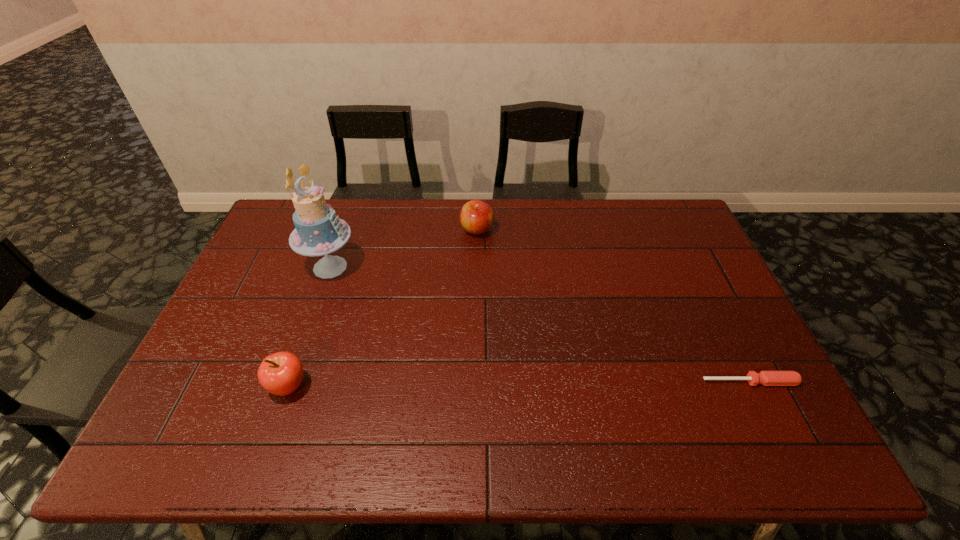
Where is `vacant space located with a ladder on the side of the cake`? The image size is (960, 540). vacant space located with a ladder on the side of the cake is located at coordinates point(438,347).

The height and width of the screenshot is (540, 960). I want to click on free space located 0.210m on the stem of the farther apple, so pos(479,285).

Where is `vacant point located 0.150m on the stem of the farther apple`? vacant point located 0.150m on the stem of the farther apple is located at coordinates [x=479, y=272].

Find the location of `vacant position located on the stem of the farther apple`. vacant position located on the stem of the farther apple is located at coordinates (481, 335).

Where is `object located in the far edge section of the desktop`? object located in the far edge section of the desktop is located at coordinates point(476,216).

Locate an element on the screen. This screenshot has width=960, height=540. apple located in the near edge section of the desktop is located at coordinates (281, 373).

You are a GUI agent. You are given a task and a screenshot of the screen. Output one action in this format:
    pyautogui.click(x=<x>, y=<y>)
    Task: Click on the screwdriver located at the near edge
    The image size is (960, 540).
    Given the screenshot: What is the action you would take?
    pyautogui.click(x=767, y=378)

The height and width of the screenshot is (540, 960). Identify the location of object present at the right edge. (767, 378).

Locate an element on the screen. The height and width of the screenshot is (540, 960). object that is at the near right corner is located at coordinates (767, 378).

Where is `free space at the far edge`? The image size is (960, 540). free space at the far edge is located at coordinates (517, 214).